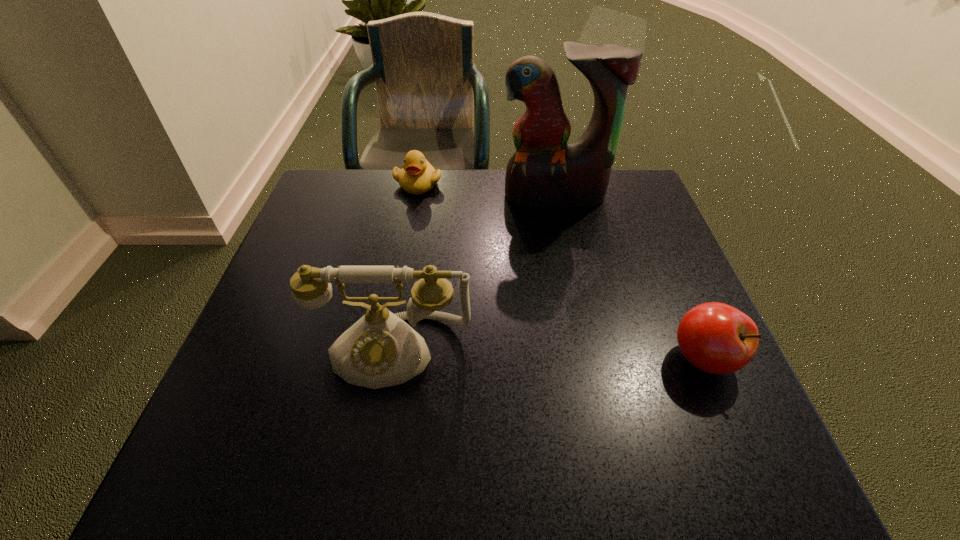
Locate an element on the screen. This screenshot has height=540, width=960. empty space between the tallest object and the rightmost object is located at coordinates (629, 278).

Locate an element on the screen. This screenshot has height=540, width=960. free area in between the rightmost object and the telephone is located at coordinates (548, 354).

Locate an element on the screen. The height and width of the screenshot is (540, 960). free space between the tallest object and the rightmost object is located at coordinates (629, 278).

Locate an element on the screen. free space between the rightmost object and the parrot is located at coordinates (629, 278).

In order to click on vacant region between the tallest object and the second tallest object in this screenshot , I will do `click(473, 273)`.

Locate an element on the screen. vacant space that is in between the third shortest object and the rightmost object is located at coordinates (548, 354).

Where is `unoccupied position between the apple and the telephone`? This screenshot has height=540, width=960. unoccupied position between the apple and the telephone is located at coordinates (548, 354).

You are a GUI agent. You are given a task and a screenshot of the screen. Output one action in this format:
    pyautogui.click(x=<x>, y=<y>)
    Task: Click on the vacant space that is in between the second tallest object and the apple
    The width and height of the screenshot is (960, 540).
    Given the screenshot: What is the action you would take?
    pyautogui.click(x=548, y=354)

Find the location of a particular element. This screenshot has width=960, height=540. object that is the second closest one to the apple is located at coordinates (544, 172).

The image size is (960, 540). In order to click on the second closest object to the parrot in this screenshot , I will do `click(380, 350)`.